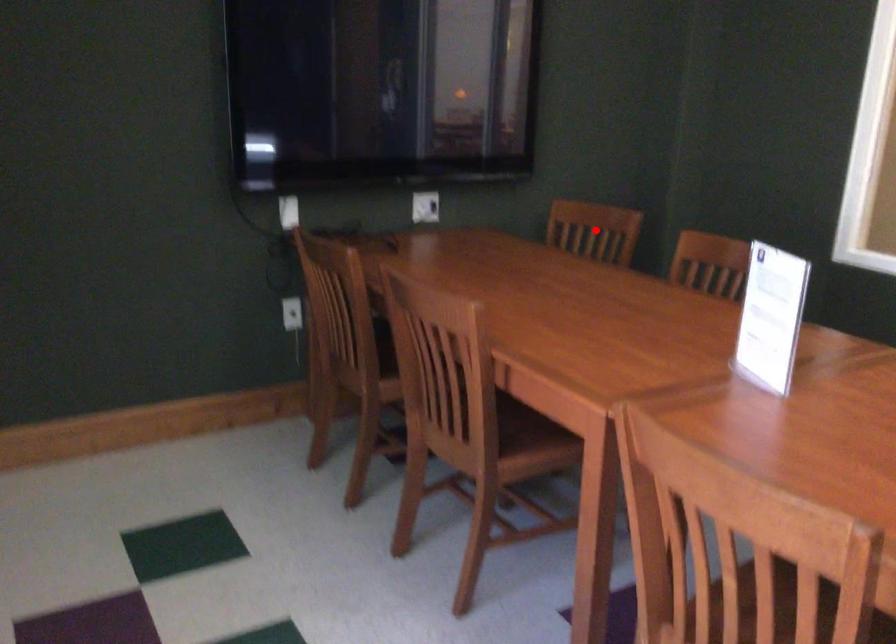
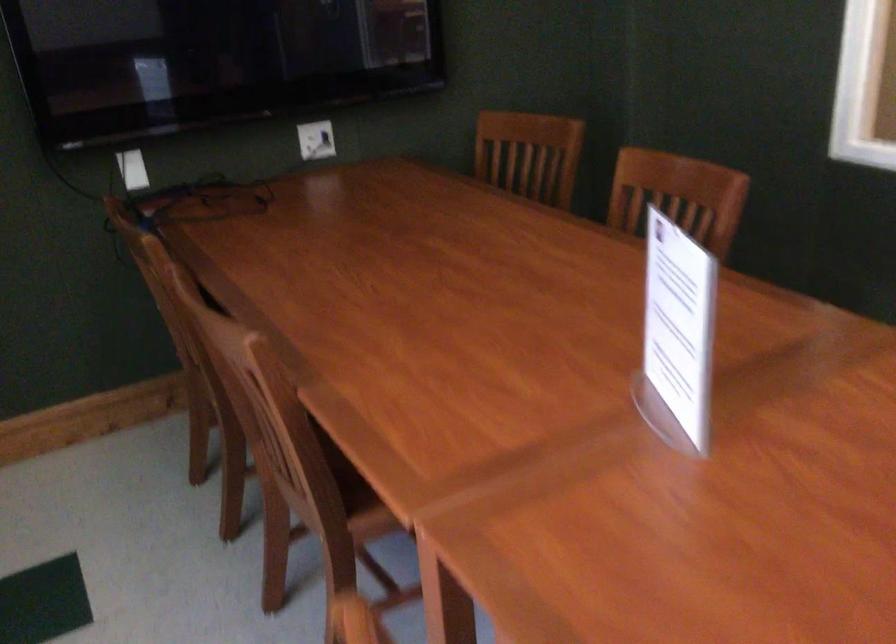
Question: I am providing you with two images of the same scene from different viewpoints. A red point is shown in image1. For the corresponding object point in image2, is it positioned nearer or farther from the camera?

Choices:
 (A) Nearer
 (B) Farther

Answer: (A)